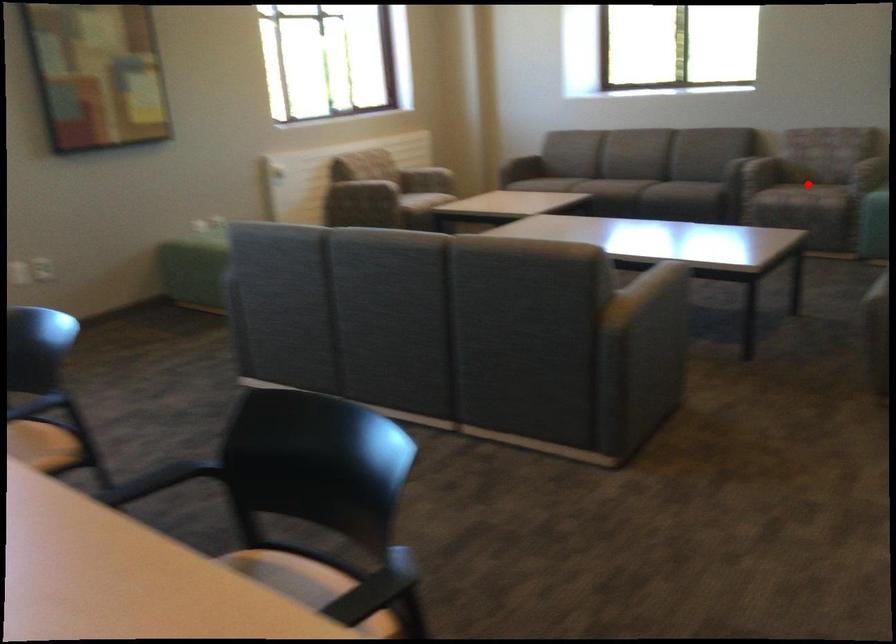
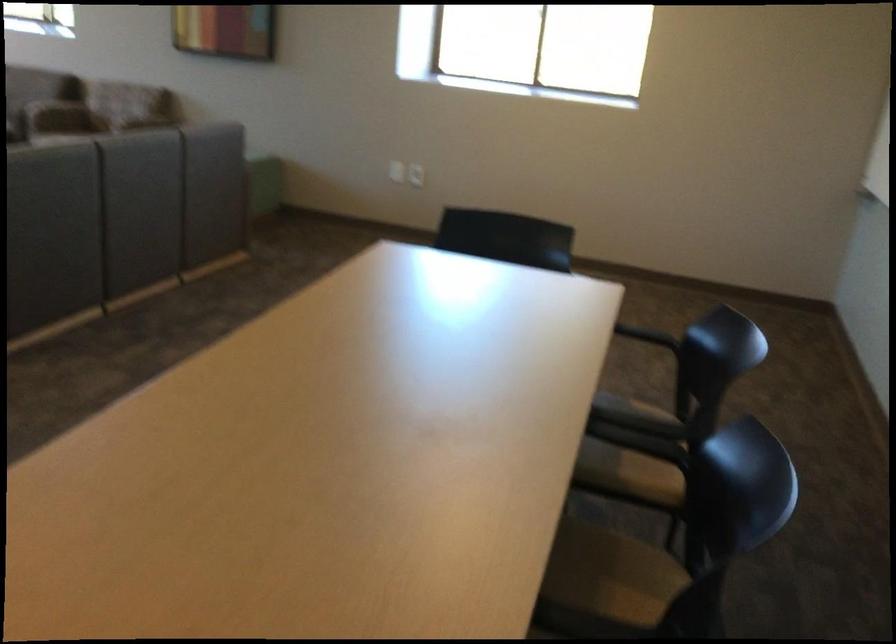
Question: I am providing you with two images of the same scene from different viewpoints. A red point is marked on the first image. Can you still see the location of the red point in image 2?

Choices:
 (A) Yes
 (B) No

Answer: (B)